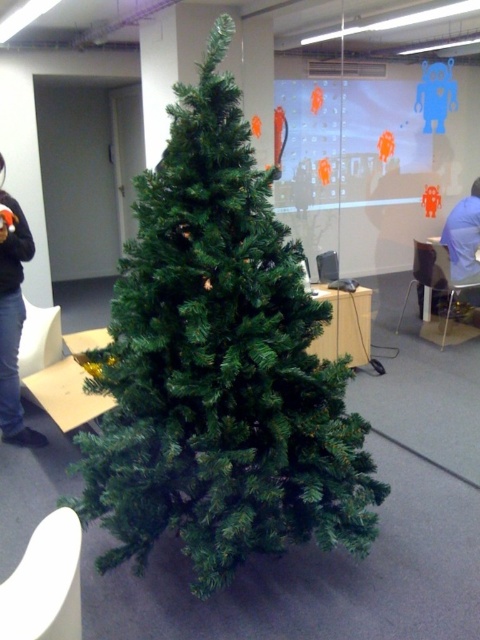
Question: Which point appears farthest from the camera in this image?

Choices:
 (A) (11, 388)
 (B) (110, 364)
 (C) (465, 248)

Answer: (C)

Question: Among these objects, which one is farthest from the camera?

Choices:
 (A) black sweater at left
 (B) blue fabric shirt at right
 (C) green matte christmas tree at center

Answer: (B)

Question: Does black sweater at left appear on the left side of blue fabric shirt at right?

Choices:
 (A) yes
 (B) no

Answer: (A)

Question: Which point is closer to the camera taking this photo?

Choices:
 (A) (267, 486)
 (B) (14, 381)
 (C) (478, 234)

Answer: (A)

Question: Can you confirm if green matte christmas tree at center is positioned below black sweater at left?

Choices:
 (A) no
 (B) yes

Answer: (B)

Question: Is black sweater at left above blue fabric shirt at right?

Choices:
 (A) no
 (B) yes

Answer: (A)